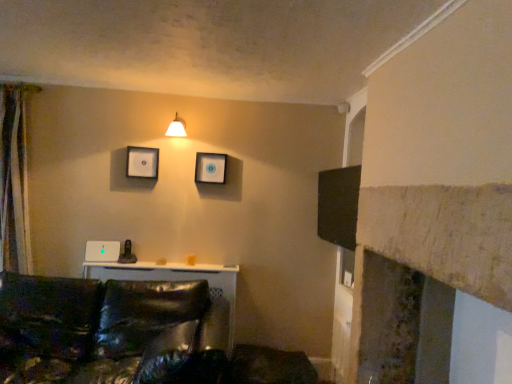
Where is `shiny black leather couch at lower left`? Image resolution: width=512 pixels, height=384 pixels. shiny black leather couch at lower left is located at coordinates (129, 335).

What is the approximate height of matte white picture frame at upper center, the 2th picture frame from the right?

10.63 inches.

I want to click on silky beige curtain at left, so click(14, 180).

What do you see at coordinates (210, 168) in the screenshot? I see `matte plastic picture frame at upper center, placed as the 1th picture frame when sorted from right to left` at bounding box center [210, 168].

How much space does matte plastic picture frame at upper center, placed as the 1th picture frame when sorted from right to left, occupy vertically?

matte plastic picture frame at upper center, placed as the 1th picture frame when sorted from right to left, is 26.52 centimeters in height.

Find the location of `shiny black leather couch at lower left`. shiny black leather couch at lower left is located at coordinates (129, 335).

Which is less distant, (152,165) or (211,330)?

Point (152,165) is positioned farther from the camera compared to point (211,330).

Considering the sizes of objects matte white picture frame at upper center, the 2th picture frame from the right, and shiny black leather couch at lower left in the image provided, who is taller, matte white picture frame at upper center, the 2th picture frame from the right, or shiny black leather couch at lower left?

Standing taller between the two is shiny black leather couch at lower left.

Is matte white picture frame at upper center, the first picture frame positioned from the left, in front of shiny black leather couch at lower left?

No.

From the image's perspective, is shiny black leather couch at lower left above matte white picture frame at upper center, the 2th picture frame from the right?

No, from the image's perspective, shiny black leather couch at lower left is not over matte white picture frame at upper center, the 2th picture frame from the right.

Between shiny black leather couch at lower left and matte white picture frame at upper center, the 2th picture frame from the right, which one has larger size?

shiny black leather couch at lower left.

Is point (61, 324) behind point (155, 163)?

No, it is in front of (155, 163).

Could you measure the distance between shiny black leather couch at lower left and matte white picture frame at upper center, the first picture frame positioned from the left?

shiny black leather couch at lower left and matte white picture frame at upper center, the first picture frame positioned from the left, are 1.17 meters apart.

Is point (218, 176) positioned behind point (152, 149)?

Yes, point (218, 176) is behind point (152, 149).

From the image's perspective, would you say matte plastic picture frame at upper center, placed as the 1th picture frame when sorted from right to left, is shown under matte white picture frame at upper center, the 2th picture frame from the right?

Yes, from the image's perspective, matte plastic picture frame at upper center, placed as the 1th picture frame when sorted from right to left, is beneath matte white picture frame at upper center, the 2th picture frame from the right.

Which object is closer to the camera, matte plastic picture frame at upper center, placed as the 1th picture frame when sorted from right to left, or matte white picture frame at upper center, the 2th picture frame from the right?

matte white picture frame at upper center, the 2th picture frame from the right, is in front.

Do you think matte plastic picture frame at upper center, which appears as the second picture frame when viewed from the left, is within matte white picture frame at upper center, the 2th picture frame from the right, or outside of it?

matte plastic picture frame at upper center, which appears as the second picture frame when viewed from the left, is located beyond the bounds of matte white picture frame at upper center, the 2th picture frame from the right.

What's the angular difference between silky beige curtain at left and matte white picture frame at upper center, the first picture frame positioned from the left,'s facing directions?

There is a 0.00322-degree angle between the facing directions of silky beige curtain at left and matte white picture frame at upper center, the first picture frame positioned from the left.

Considering the points (7, 83) and (133, 157), which point is in front, point (7, 83) or point (133, 157)?

The point (7, 83) is closer.

Is silky beige curtain at left closer to camera compared to matte white picture frame at upper center, the first picture frame positioned from the left?

Yes, silky beige curtain at left is closer to the viewer.

Which of these two, matte plastic picture frame at upper center, which appears as the second picture frame when viewed from the left, or silky beige curtain at left, is smaller?

Smaller between the two is matte plastic picture frame at upper center, which appears as the second picture frame when viewed from the left.

Which object is positioned more to the left, matte plastic picture frame at upper center, which appears as the second picture frame when viewed from the left, or silky beige curtain at left?

Positioned to the left is silky beige curtain at left.

From a real-world perspective, who is located lower, matte plastic picture frame at upper center, which appears as the second picture frame when viewed from the left, or silky beige curtain at left?

In real-world perspective, silky beige curtain at left is lower.

From the image's perspective, which object appears higher, silky beige curtain at left or matte white wall sconce at upper center?

matte white wall sconce at upper center is shown above in the image.

Who is bigger, silky beige curtain at left or matte white wall sconce at upper center?

silky beige curtain at left.

Looking at this image, is silky beige curtain at left facing away from matte white wall sconce at upper center?

No.

Is shiny black leather couch at lower left with matte white wall sconce at upper center?

They are not placed beside each other.

From the picture: Considering the sizes of objects shiny black leather couch at lower left and matte white wall sconce at upper center in the image provided, who is taller, shiny black leather couch at lower left or matte white wall sconce at upper center?

With more height is shiny black leather couch at lower left.

From a real-world perspective, is shiny black leather couch at lower left on matte white wall sconce at upper center?

No, from a real-world perspective, shiny black leather couch at lower left is not on top of matte white wall sconce at upper center.

You are a GUI agent. You are given a task and a screenshot of the screen. Output one action in this format:
    pyautogui.click(x=<x>, y=<y>)
    Task: Click on the 1st picture frame to the right of the shiny black leather couch at lower left, starting your count from the anchor
    Image resolution: width=512 pixels, height=384 pixels.
    Given the screenshot: What is the action you would take?
    pyautogui.click(x=142, y=162)

You are a GUI agent. You are given a task and a screenshot of the screen. Output one action in this format:
    pyautogui.click(x=<x>, y=<y>)
    Task: Click on the studio couch below the matte white picture frame at upper center, the 2th picture frame from the right (from a real-world perspective)
    The image size is (512, 384).
    Given the screenshot: What is the action you would take?
    pyautogui.click(x=129, y=335)

Estimate the real-world distances between objects in this image. Which object is closer to matte plastic picture frame at upper center, which appears as the second picture frame when viewed from the left, matte white wall sconce at upper center or shiny black leather couch at lower left?

matte white wall sconce at upper center is closer to matte plastic picture frame at upper center, which appears as the second picture frame when viewed from the left.

When comparing their distances from matte white picture frame at upper center, the 2th picture frame from the right, does silky beige curtain at left or shiny black leather couch at lower left seem further?

shiny black leather couch at lower left is further to matte white picture frame at upper center, the 2th picture frame from the right.

Based on their spatial positions, is matte white wall sconce at upper center or matte plastic picture frame at upper center, which appears as the second picture frame when viewed from the left, closer to shiny black leather couch at lower left?

Among the two, matte plastic picture frame at upper center, which appears as the second picture frame when viewed from the left, is located nearer to shiny black leather couch at lower left.

Looking at the image, which one is located further to silky beige curtain at left, matte white wall sconce at upper center or shiny black leather couch at lower left?

Based on the image, matte white wall sconce at upper center appears to be further to silky beige curtain at left.

Considering their positions, is shiny black leather couch at lower left positioned closer to matte white picture frame at upper center, the 2th picture frame from the right, than matte plastic picture frame at upper center, which appears as the second picture frame when viewed from the left?

Based on the image, matte plastic picture frame at upper center, which appears as the second picture frame when viewed from the left, appears to be nearer to matte white picture frame at upper center, the 2th picture frame from the right.

When comparing their distances from shiny black leather couch at lower left, does matte plastic picture frame at upper center, which appears as the second picture frame when viewed from the left, or matte white picture frame at upper center, the first picture frame positioned from the left, seem closer?

matte white picture frame at upper center, the first picture frame positioned from the left, lies closer to shiny black leather couch at lower left than the other object.

Looking at the image, which one is located further to matte white wall sconce at upper center, shiny black leather couch at lower left or matte white picture frame at upper center, the first picture frame positioned from the left?

shiny black leather couch at lower left lies further to matte white wall sconce at upper center than the other object.

Estimate the real-world distances between objects in this image. Which object is closer to matte white wall sconce at upper center, silky beige curtain at left or matte white picture frame at upper center, the 2th picture frame from the right?

matte white picture frame at upper center, the 2th picture frame from the right, lies closer to matte white wall sconce at upper center than the other object.

Find the location of a particular element. This screenshot has height=384, width=512. curtain between shiny black leather couch at lower left and matte white picture frame at upper center, the first picture frame positioned from the left, along the z-axis is located at coordinates (14, 180).

Image resolution: width=512 pixels, height=384 pixels. I want to click on picture frame between shiny black leather couch at lower left and matte plastic picture frame at upper center, which appears as the second picture frame when viewed from the left, along the z-axis, so click(142, 162).

This screenshot has height=384, width=512. I want to click on picture frame located between silky beige curtain at left and matte plastic picture frame at upper center, which appears as the second picture frame when viewed from the left, in the left-right direction, so click(142, 162).

Locate an element on the screen. The width and height of the screenshot is (512, 384). curtain that lies between matte white wall sconce at upper center and shiny black leather couch at lower left from top to bottom is located at coordinates (14, 180).